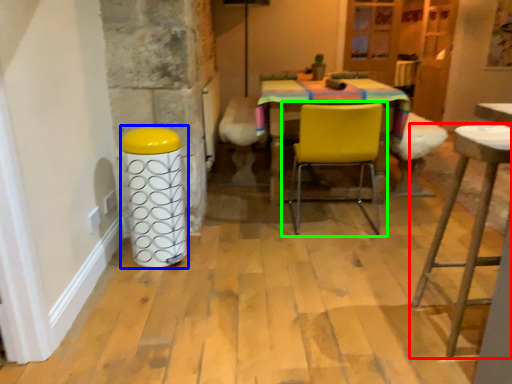
Question: Which object is positioned closest to stool (highlighted by a red box)? Select from bar stool (highlighted by a blue box) and chair (highlighted by a green box).

Choices:
 (A) bar stool
 (B) chair

Answer: (B)